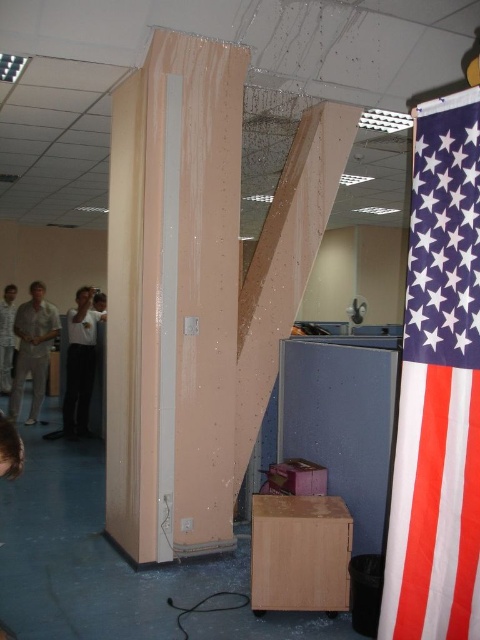
Question: Estimate the real-world distances between objects in this image. Which object is farther from the matte beige shirt at left?

Choices:
 (A) white matte shirt at left
 (B) white glossy shirt at center
 (C) red-white-blue fabric flag at right
 (D) peach foamboard at center

Answer: (C)

Question: Does white glossy shirt at center lie behind white matte shirt at left?

Choices:
 (A) no
 (B) yes

Answer: (A)

Question: Which object is closer to the camera taking this photo?

Choices:
 (A) peach foamboard at center
 (B) white glossy shirt at center
 (C) matte beige shirt at left
 (D) red-white-blue fabric flag at right

Answer: (D)

Question: Is red-white-blue fabric flag at right wider than matte beige shirt at left?

Choices:
 (A) yes
 (B) no

Answer: (B)

Question: Is white glossy shirt at center above white matte shirt at left?

Choices:
 (A) yes
 (B) no

Answer: (B)

Question: Which is nearer to the white glossy shirt at center?

Choices:
 (A) peach foamboard at center
 (B) red-white-blue fabric flag at right
 (C) white matte shirt at left

Answer: (C)